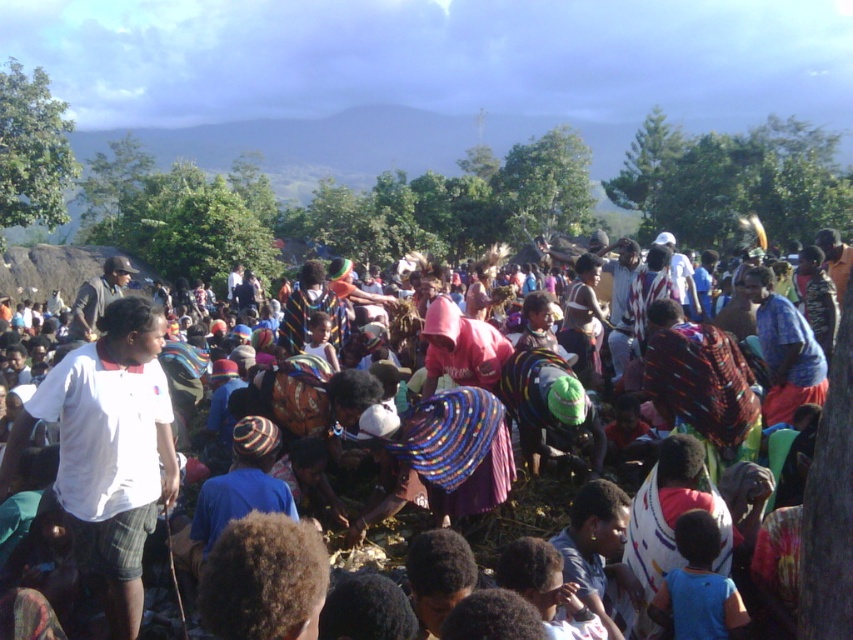
You are a photographer at the event and want to capture both the white cotton shirt at center and the multicolored woven fabric at center in a single frame. Which object should you position on the left side of your camera viewfinder to ensure both are included?

To include both the white cotton shirt at center and the multicolored woven fabric at center in your frame, position the white cotton shirt at center on the left side of your camera viewfinder since it is already to the left of the multicolored woven fabric at center.

You are organizing a photo shoot and need to place a white cotton shirt at center and a multicolored woven fabric at center in the scene. Since the scene is crowded, you need to ensure there is enough space. Which object is wider so you can prioritize placing it first?

The white cotton shirt at center might be wider than multicolored woven fabric at center, so you should prioritize placing the white cotton shirt at center first to ensure there is enough space.